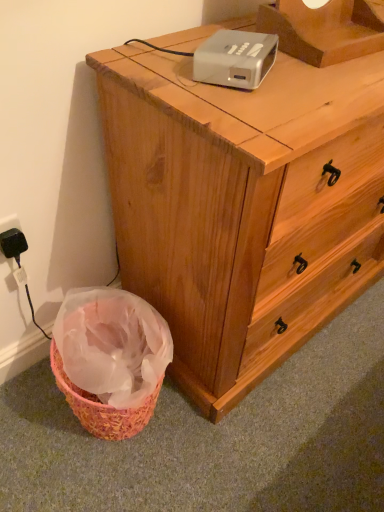
Question: Is wooden chest of drawers at center inside the boundaries of white plastic projector at upper center, or outside?

Choices:
 (A) inside
 (B) outside

Answer: (B)

Question: Is wooden chest of drawers at center taller or shorter than white plastic projector at upper center?

Choices:
 (A) short
 (B) tall

Answer: (B)

Question: Which of these objects is positioned closest to the black plastic electric outlet at lower left?

Choices:
 (A) white plastic projector at upper center
 (B) wooden chest of drawers at center

Answer: (B)

Question: Which is nearer to the black plastic electric outlet at lower left?

Choices:
 (A) white plastic projector at upper center
 (B) wooden chest of drawers at center

Answer: (B)